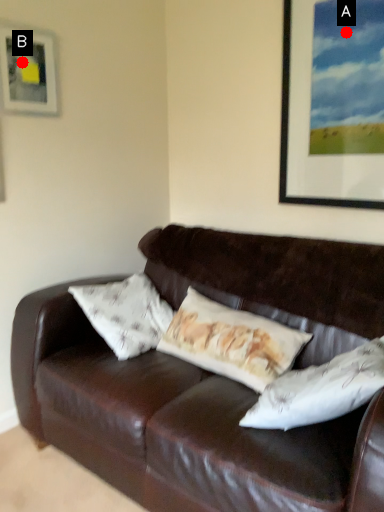
Question: Two points are circled on the image, labeled by A and B beside each circle. Which point appears farthest from the camera in this image?

Choices:
 (A) A is further
 (B) B is further

Answer: (B)